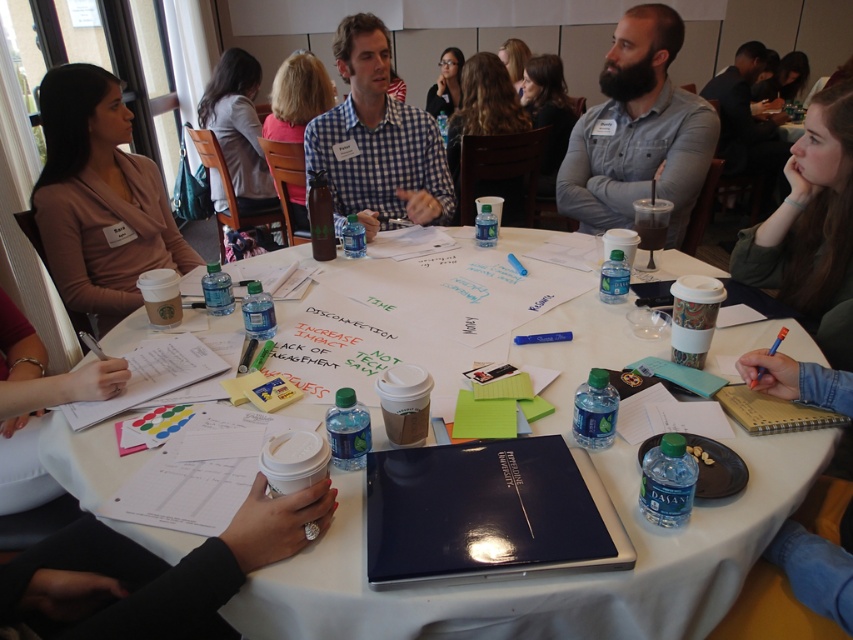
Question: Is the position of matte black laptop at center less distant than that of green matte jacket at upper right?

Choices:
 (A) yes
 (B) no

Answer: (A)

Question: Estimate the real-world distances between objects in this image. Which object is farther from the green matte jacket at upper right?

Choices:
 (A) checkered fabric shirt at center
 (B) gray denim shirt at upper right

Answer: (A)

Question: Among these points, which one is nearest to the camera?

Choices:
 (A) (171, 227)
 (B) (695, 186)
 (C) (746, 253)
 (D) (386, 612)

Answer: (D)

Question: Can you confirm if matte black laptop at center is positioned below gray denim shirt at upper right?

Choices:
 (A) no
 (B) yes

Answer: (B)

Question: Is gray denim shirt at upper right positioned in front of green matte jacket at upper right?

Choices:
 (A) no
 (B) yes

Answer: (A)

Question: Considering the real-world distances, which object is closest to the gray denim shirt at upper right?

Choices:
 (A) matte black laptop at center
 (B) green matte jacket at upper right
 (C) matte brown sweater at upper left

Answer: (B)